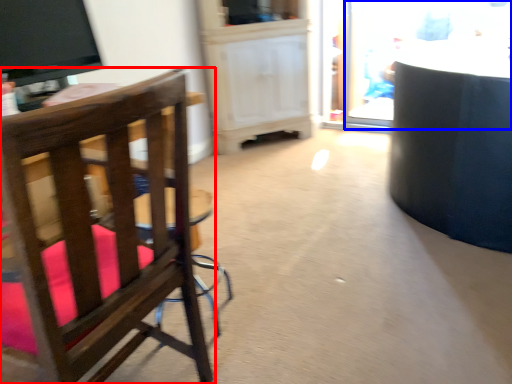
Question: Which of the following is the closest to the observer, chair (highlighted by a red box) or glass door (highlighted by a blue box)?

Choices:
 (A) chair
 (B) glass door

Answer: (A)